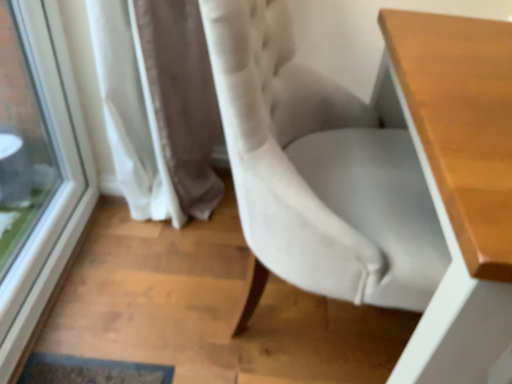
Locate an element on the screen. The height and width of the screenshot is (384, 512). free space in front of white textured curtain at lower left is located at coordinates (146, 275).